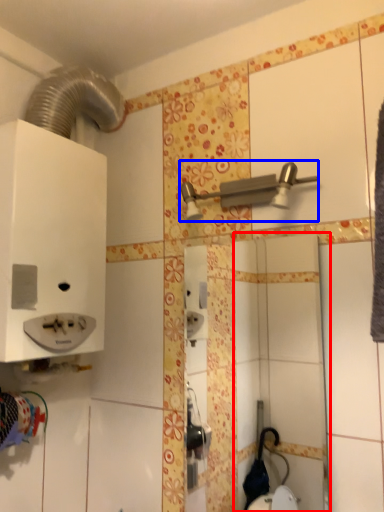
Question: Which object is further to the camera taking this photo, mirror (highlighted by a red box) or shower (highlighted by a blue box)?

Choices:
 (A) mirror
 (B) shower

Answer: (A)